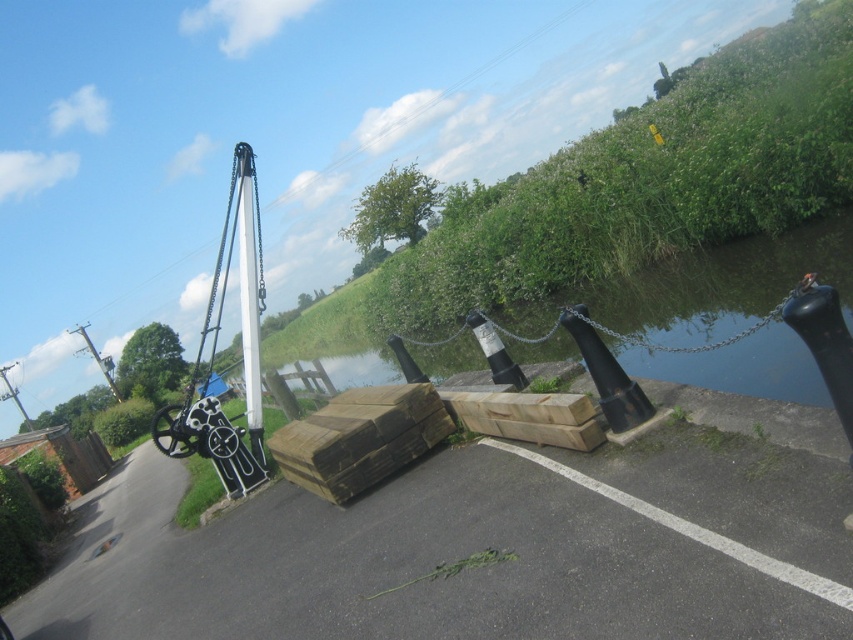
Describe the element at coordinates (708, 288) in the screenshot. I see `smooth concrete waterway at center` at that location.

You are a GUI agent. You are given a task and a screenshot of the screen. Output one action in this format:
    pyautogui.click(x=<x>, y=<y>)
    Task: Click on the smooth concrete waterway at center
    Image resolution: width=853 pixels, height=640 pixels.
    Given the screenshot: What is the action you would take?
    pyautogui.click(x=708, y=288)